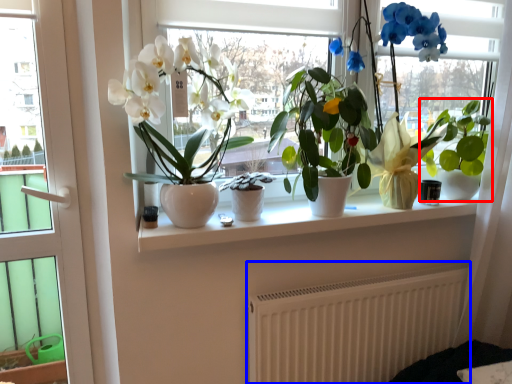
Question: Which object appears closest to the camera in this image, houseplant (highlighted by a red box) or radiator (highlighted by a blue box)?

Choices:
 (A) houseplant
 (B) radiator

Answer: (B)